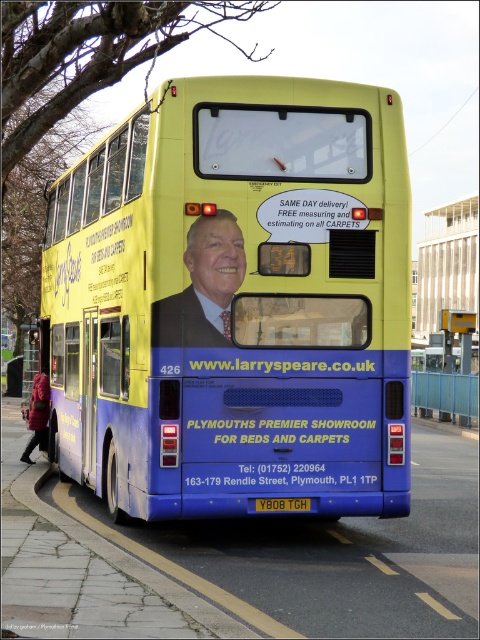
Who is taller, yellow matte bus at center or smooth suit at center?

yellow matte bus at center

Which is above, yellow matte bus at center or smooth suit at center?

Positioned higher is smooth suit at center.

Locate an element on the screen. The height and width of the screenshot is (640, 480). yellow matte bus at center is located at coordinates [x=236, y=301].

The image size is (480, 640). I want to click on yellow matte bus at center, so click(x=236, y=301).

From the picture: Can you confirm if smooth suit at center is positioned to the right of yellow metallic license plate at center?

Incorrect, smooth suit at center is not on the right side of yellow metallic license plate at center.

Is point (190, 289) farther from camera compared to point (304, 502)?

That is False.

Between point (219, 234) and point (299, 506), which one is positioned behind?

Positioned behind is point (299, 506).

Find the location of a particular element. The width and height of the screenshot is (480, 640). smooth suit at center is located at coordinates (204, 285).

Does yellow matte bus at center lie in front of yellow metallic license plate at center?

No.

Is point (168, 291) positioned behind point (283, 506)?

No.

Which is in front, point (99, 332) or point (259, 502)?

Point (259, 502) is in front.

You are a GUI agent. You are given a task and a screenshot of the screen. Output one action in this format:
    pyautogui.click(x=<x>, y=<y>)
    Task: Click on the yellow matte bus at center
    Image resolution: width=480 pixels, height=640 pixels.
    Given the screenshot: What is the action you would take?
    [x=236, y=301]